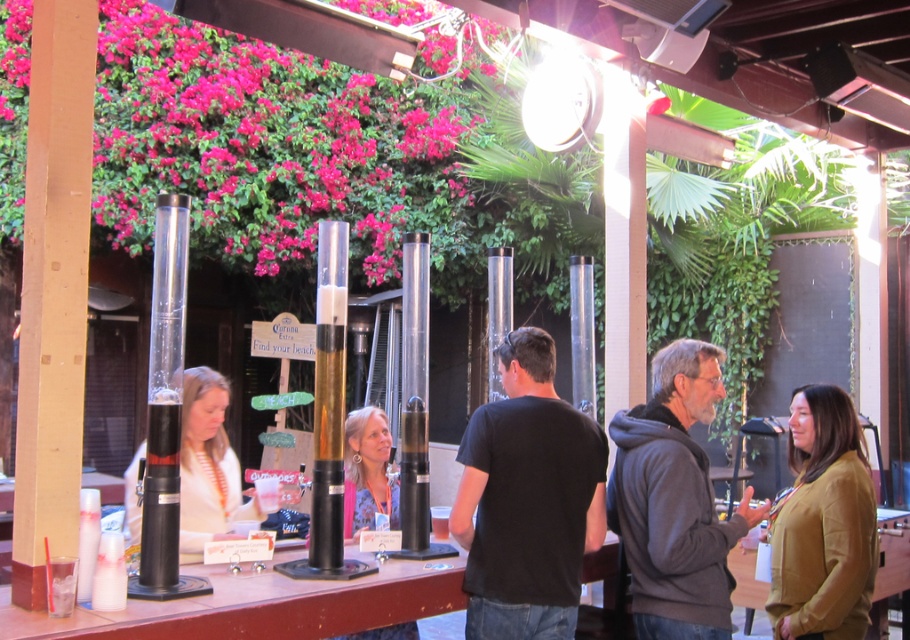
You are a photographer positioned at the center of the scene. You want to take a photo that includes both the white striped shirt at left and the wooden table at lower right. Which object should you focus on first to ensure both are in clear view?

You should focus on the white striped shirt at left first because it is closer to the viewer than the wooden table at lower right, so focusing on the closer object will help keep both in focus.

You are a server at the bar and need to deliver a drink to the person wearing the white striped shirt at left. The wooden table at lower right is in the way. Can you walk around it to reach the customer?

The distance between the white striped shirt at left and the wooden table at lower right is 2.94 meters. Since the table is in the way, you can walk around it to reach the customer as there is enough space between them.